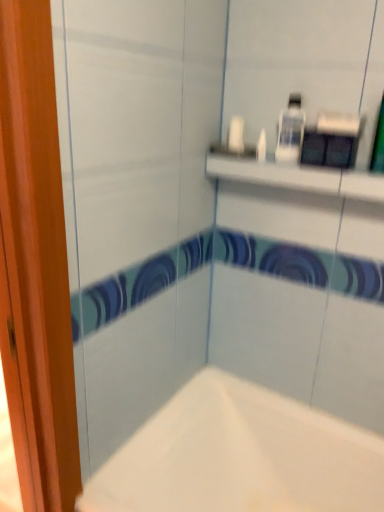
The width and height of the screenshot is (384, 512). What do you see at coordinates (290, 130) in the screenshot?
I see `white glossy bottle at upper center` at bounding box center [290, 130].

In order to face white glossy bottle at upper center, should I rotate leftwards or rightwards?

Turn right approximately 13.379 degrees to face it.

Image resolution: width=384 pixels, height=512 pixels. What are the coordinates of `white glossy bottle at upper center` in the screenshot? It's located at [290, 130].

What is the approximate width of white glossy bottle at upper center?

white glossy bottle at upper center is 4.56 centimeters wide.

What do you see at coordinates (240, 456) in the screenshot? This screenshot has width=384, height=512. I see `white matte bathtub at lower center` at bounding box center [240, 456].

Identify the location of white matte bathtub at lower center. Image resolution: width=384 pixels, height=512 pixels. pos(240,456).

Measure the distance between white matte bathtub at lower center and camera.

The depth of white matte bathtub at lower center is 1.06 meters.

Image resolution: width=384 pixels, height=512 pixels. What are the coordinates of `white glossy bottle at upper center` in the screenshot? It's located at (290, 130).

Can you confirm if white matte bathtub at lower center is positioned to the right of white glossy bottle at upper center?

Incorrect, white matte bathtub at lower center is not on the right side of white glossy bottle at upper center.

Is white matte bathtub at lower center closer to the viewer compared to white glossy bottle at upper center?

That is True.

Which point is more forward, [106,473] or [299,129]?

The point [106,473] is in front.

From the image's perspective, which object appears higher, white matte bathtub at lower center or white glossy bottle at upper center?

From the image's view, white glossy bottle at upper center is above.

From a real-world perspective, is white matte bathtub at lower center located higher than white glossy bottle at upper center?

No, from a real-world perspective, white matte bathtub at lower center is not over white glossy bottle at upper center

Is white matte bathtub at lower center wider than white glossy bottle at upper center?

Yes, white matte bathtub at lower center is wider than white glossy bottle at upper center.

Considering the sizes of white matte bathtub at lower center and white glossy bottle at upper center in the image, is white matte bathtub at lower center taller or shorter than white glossy bottle at upper center?

Considering their sizes, white matte bathtub at lower center has more height than white glossy bottle at upper center.

Is white matte bathtub at lower center bigger than white glossy bottle at upper center?

Indeed, white matte bathtub at lower center has a larger size compared to white glossy bottle at upper center.

Can white glossy bottle at upper center be found inside white matte bathtub at lower center?

Definitely not — white glossy bottle at upper center is not inside white matte bathtub at lower center.

Are white matte bathtub at lower center and white glossy bottle at upper center located far from each other?

white matte bathtub at lower center is near white glossy bottle at upper center, not far away.

Is white matte bathtub at lower center facing towards white glossy bottle at upper center?

No, white matte bathtub at lower center does not turn towards white glossy bottle at upper center.

Measure the distance between white matte bathtub at lower center and white glossy bottle at upper center.

37.77 inches.

This screenshot has width=384, height=512. Find the location of `bathtub below the white glossy bottle at upper center (from a real-world perspective)`. bathtub below the white glossy bottle at upper center (from a real-world perspective) is located at coordinates (240, 456).

Can you confirm if white glossy bottle at upper center is positioned to the right of white matte bathtub at lower center?

Correct, you'll find white glossy bottle at upper center to the right of white matte bathtub at lower center.

Between white glossy bottle at upper center and white matte bathtub at lower center, which one is positioned in front?

white matte bathtub at lower center is in front.

Is point (277, 147) positioned after point (330, 506)?

No.

From the image's perspective, which is above, white glossy bottle at upper center or white matte bathtub at lower center?

white glossy bottle at upper center.

From a real-world perspective, is white glossy bottle at upper center physically located above or below white matte bathtub at lower center?

Clearly, from a real-world perspective, white glossy bottle at upper center is above white matte bathtub at lower center.

Can you confirm if white glossy bottle at upper center is wider than white matte bathtub at lower center?

Incorrect, the width of white glossy bottle at upper center does not surpass that of white matte bathtub at lower center.

Is white glossy bottle at upper center shorter than white matte bathtub at lower center?

Yes, white glossy bottle at upper center is shorter than white matte bathtub at lower center.

Based on their sizes in the image, would you say white glossy bottle at upper center is bigger or smaller than white matte bathtub at lower center?

In the image, white glossy bottle at upper center appears to be smaller than white matte bathtub at lower center.

Would you say white glossy bottle at upper center contains white matte bathtub at lower center?

No.

Is white glossy bottle at upper center not close to white matte bathtub at lower center?

Actually, white glossy bottle at upper center and white matte bathtub at lower center are a little close together.

Could you tell me if white glossy bottle at upper center is turned towards white matte bathtub at lower center?

No, white glossy bottle at upper center does not turn towards white matte bathtub at lower center.

What's the angular difference between white glossy bottle at upper center and white matte bathtub at lower center's facing directions?

The angular difference between white glossy bottle at upper center and white matte bathtub at lower center is 0.992 degrees.

Find the location of a particular element. This screenshot has width=384, height=512. bathtub that appears on the left of white glossy bottle at upper center is located at coordinates (240, 456).

You are a GUI agent. You are given a task and a screenshot of the screen. Output one action in this format:
    pyautogui.click(x=<x>, y=<y>)
    Task: Click on the bathtub located underneath the white glossy bottle at upper center (from a real-world perspective)
    
    Given the screenshot: What is the action you would take?
    pyautogui.click(x=240, y=456)

This screenshot has width=384, height=512. What are the coordinates of `bathtub on the left of the white glossy bottle at upper center` in the screenshot? It's located at (240, 456).